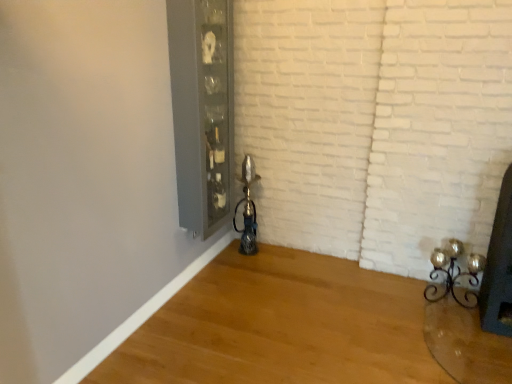
This screenshot has width=512, height=384. What do you see at coordinates (202, 109) in the screenshot? I see `clear glass cabinet at upper center` at bounding box center [202, 109].

Identify the location of clear glass cabinet at upper center. (202, 109).

Find the location of a particular element. gold metallic candle holder at lower right is located at coordinates (454, 271).

The width and height of the screenshot is (512, 384). What do you see at coordinates (454, 271) in the screenshot? I see `gold metallic candle holder at lower right` at bounding box center [454, 271].

Image resolution: width=512 pixels, height=384 pixels. Identify the location of clear glass cabinet at upper center. (202, 109).

Can you confirm if gold metallic candle holder at lower right is positioned to the left of clear glass cabinet at upper center?

In fact, gold metallic candle holder at lower right is to the right of clear glass cabinet at upper center.

Relative to clear glass cabinet at upper center, is gold metallic candle holder at lower right in front or behind?

Clearly, gold metallic candle holder at lower right is behind clear glass cabinet at upper center.

Does point (470, 304) come farther from viewer compared to point (225, 189)?

That is False.

From the image's perspective, is gold metallic candle holder at lower right above clear glass cabinet at upper center?

No, from the image's perspective, gold metallic candle holder at lower right is not over clear glass cabinet at upper center.

Consider the image. From a real-world perspective, is gold metallic candle holder at lower right physically located above or below clear glass cabinet at upper center?

Clearly, from a real-world perspective, gold metallic candle holder at lower right is below clear glass cabinet at upper center.

Does gold metallic candle holder at lower right have a lesser width compared to clear glass cabinet at upper center?

No, gold metallic candle holder at lower right is not thinner than clear glass cabinet at upper center.

Can you confirm if gold metallic candle holder at lower right is taller than clear glass cabinet at upper center?

No.

Does gold metallic candle holder at lower right have a larger size compared to clear glass cabinet at upper center?

No.

Is clear glass cabinet at upper center located within gold metallic candle holder at lower right?

No.

Does gold metallic candle holder at lower right touch clear glass cabinet at upper center?

gold metallic candle holder at lower right is not next to clear glass cabinet at upper center, and they're not touching.

Could you tell me if gold metallic candle holder at lower right is facing clear glass cabinet at upper center?

No.

What's the angular difference between gold metallic candle holder at lower right and clear glass cabinet at upper center's facing directions?

The angle between the facing direction of gold metallic candle holder at lower right and the facing direction of clear glass cabinet at upper center is 88.9 degrees.

The width and height of the screenshot is (512, 384). What are the coordinates of `glass door located on the left of gold metallic candle holder at lower right` in the screenshot? It's located at (202, 109).

Based on their positions, is clear glass cabinet at upper center located to the left or right of gold metallic candle holder at lower right?

clear glass cabinet at upper center is positioned on gold metallic candle holder at lower right's left side.

Does clear glass cabinet at upper center lie in front of gold metallic candle holder at lower right?

Yes, clear glass cabinet at upper center is in front of gold metallic candle holder at lower right.

Is point (183, 155) closer or farther from the camera than point (454, 254)?

Point (183, 155).

Based on the photo, from the image's perspective, which object appears higher, clear glass cabinet at upper center or gold metallic candle holder at lower right?

clear glass cabinet at upper center appears higher in the image.

From a real-world perspective, who is located higher, clear glass cabinet at upper center or gold metallic candle holder at lower right?

clear glass cabinet at upper center is physically above.

Looking at their sizes, would you say clear glass cabinet at upper center is wider or thinner than gold metallic candle holder at lower right?

Clearly, clear glass cabinet at upper center has less width compared to gold metallic candle holder at lower right.

Which of these two, clear glass cabinet at upper center or gold metallic candle holder at lower right, stands taller?

clear glass cabinet at upper center.

Between clear glass cabinet at upper center and gold metallic candle holder at lower right, which one has larger size?

Bigger between the two is clear glass cabinet at upper center.

Is gold metallic candle holder at lower right a part of clear glass cabinet at upper center?

No, gold metallic candle holder at lower right is not a part of clear glass cabinet at upper center.

Would you say clear glass cabinet at upper center is a long distance from gold metallic candle holder at lower right?

Yes, clear glass cabinet at upper center is far from gold metallic candle holder at lower right.

Does clear glass cabinet at upper center turn towards gold metallic candle holder at lower right?

Yes, clear glass cabinet at upper center is turned towards gold metallic candle holder at lower right.

What's the angular difference between clear glass cabinet at upper center and gold metallic candle holder at lower right's facing directions?

The facing directions of clear glass cabinet at upper center and gold metallic candle holder at lower right are 88.9 degrees apart.

Locate an element on the screen. This screenshot has width=512, height=384. candle holder lying below the clear glass cabinet at upper center (from the image's perspective) is located at coordinates (454, 271).

Locate an element on the screen. The height and width of the screenshot is (384, 512). candle holder directly beneath the clear glass cabinet at upper center (from a real-world perspective) is located at coordinates (454, 271).

Identify the location of candle holder behind the clear glass cabinet at upper center. This screenshot has width=512, height=384. (454, 271).